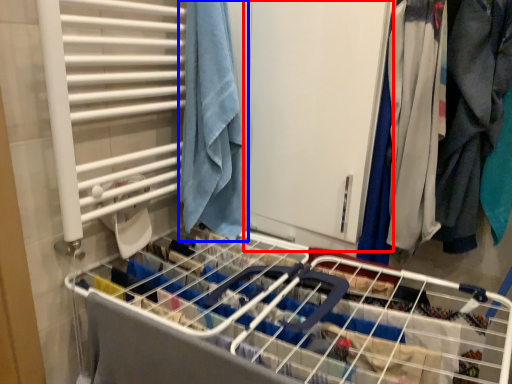
Question: Which point is closer to the camera, screen door (highlighted by a red box) or towel (highlighted by a blue box)?

Choices:
 (A) screen door
 (B) towel

Answer: (A)